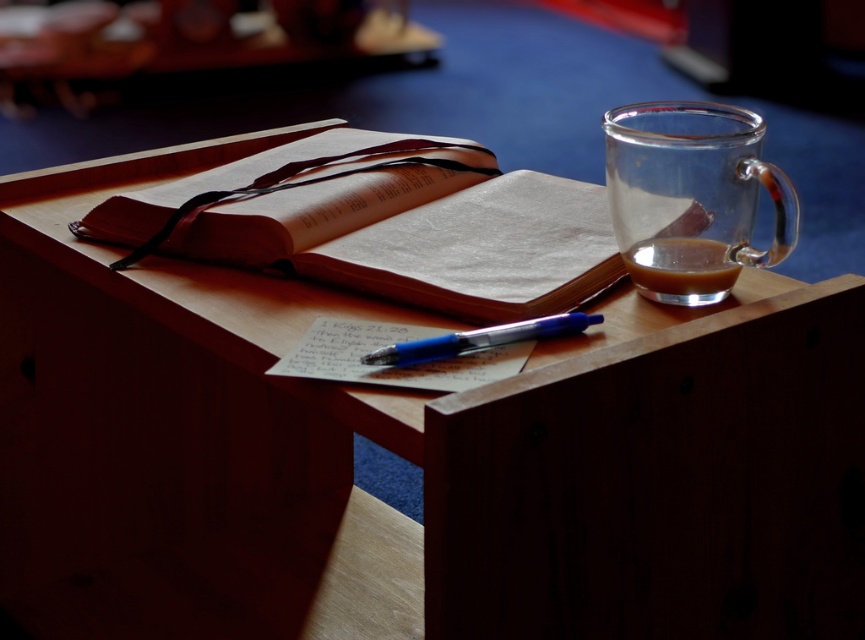
This screenshot has height=640, width=865. Describe the element at coordinates (425, 237) in the screenshot. I see `brown leather book at center` at that location.

Who is higher up, brown leather book at center or blue plastic pen at center?

Positioned higher is brown leather book at center.

Is point (584, 205) closer to viewer compared to point (380, 364)?

No, it is behind (380, 364).

In order to click on brown leather book at center in this screenshot , I will do `click(425, 237)`.

Between transparent glass mug at right and blue plastic pen at center, which one is positioned higher?

transparent glass mug at right is higher up.

Looking at this image, is transparent glass mug at right shorter than blue plastic pen at center?

Incorrect, transparent glass mug at right's height does not fall short of blue plastic pen at center's.

Does point (731, 170) come closer to viewer compared to point (428, 342)?

No, it is not.

The width and height of the screenshot is (865, 640). What are the coordinates of `transparent glass mug at right` in the screenshot? It's located at (692, 196).

Does brown leather book at center come in front of translucent glass mug at upper right?

Yes.

At what (x,y) coordinates should I click in order to perform the action: click on brown leather book at center. Please return your answer as a coordinate pair (x, y). Looking at the image, I should click on (x=425, y=237).